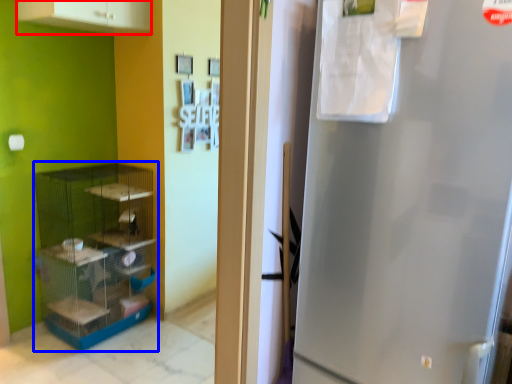
Question: Among these objects, which one is nearest to the camera, cabinetry (highlighted by a red box) or shelf (highlighted by a blue box)?

Choices:
 (A) cabinetry
 (B) shelf

Answer: (A)